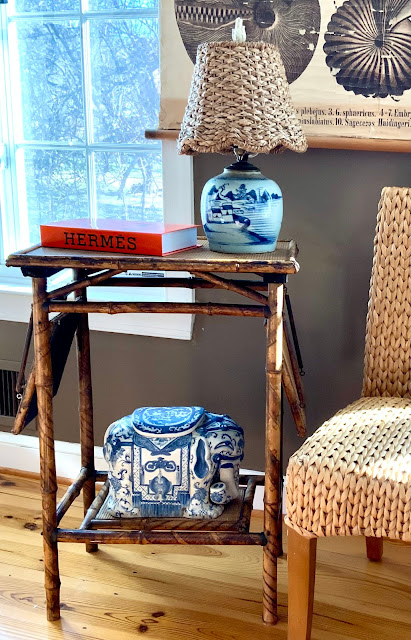
Locate an element on the screen. The width and height of the screenshot is (411, 640). wall is located at coordinates (216, 378).